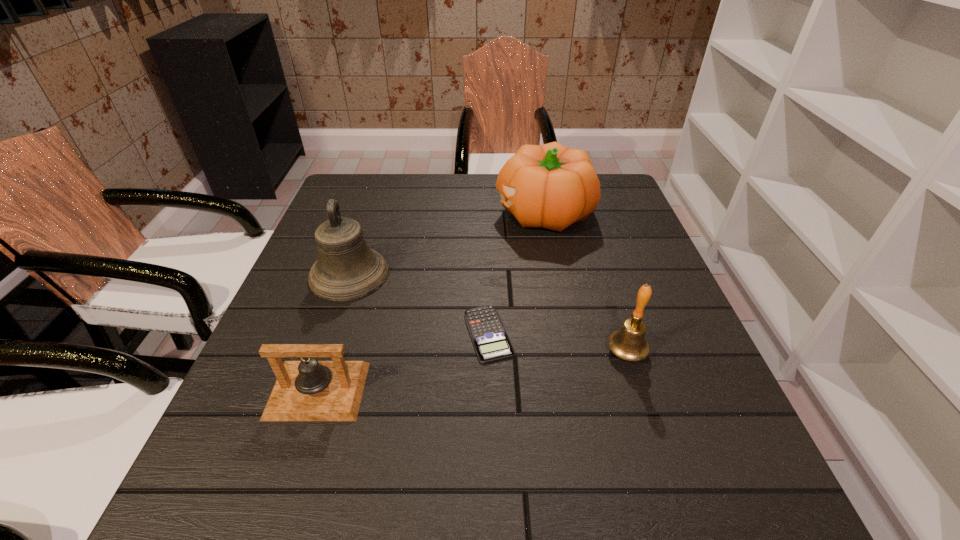
Locate an element on the screen. This screenshot has height=540, width=960. free location that satisfies the following two spatial constraints: 1. on the front side of the second farthest object; 2. on the right side of the rightmost bell is located at coordinates (323, 352).